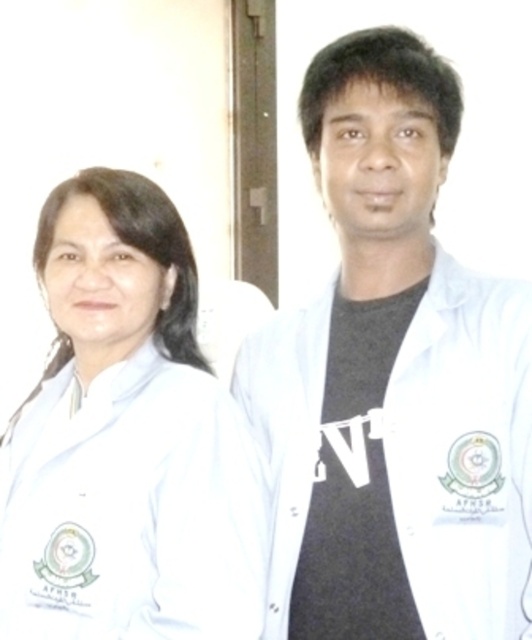
You are a tailor assessing the width of lab coats for alterations. You observe the white matte lab coat at left and the white matte lab coat at right in the scene. Which lab coat has a greater width?

The white matte lab coat at left might be wider than the white matte lab coat at right according to the description.

You are a photographer setting up a photo shoot for two scientists wearing white matte lab coats. You notice the white matte lab coat at left and the white matte lab coat at right. Which scientist should you ask to stand on a small stool to ensure both lab coats appear the same height in the photo?

The white matte lab coat at right is shorter than the white matte lab coat at left, so you should ask the scientist wearing the white matte lab coat at right to stand on a small stool to balance their heights.